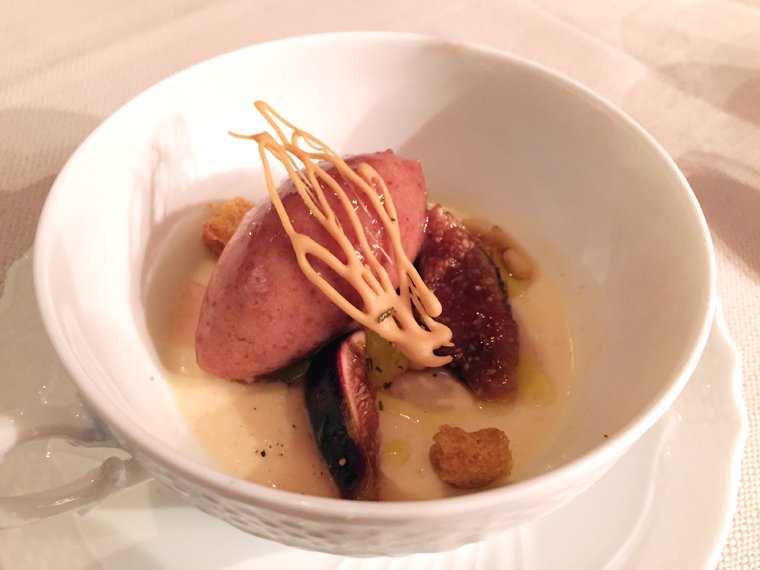
Where is `tableclotshadow`? tableclotshadow is located at coordinates (71, 88), (719, 245).